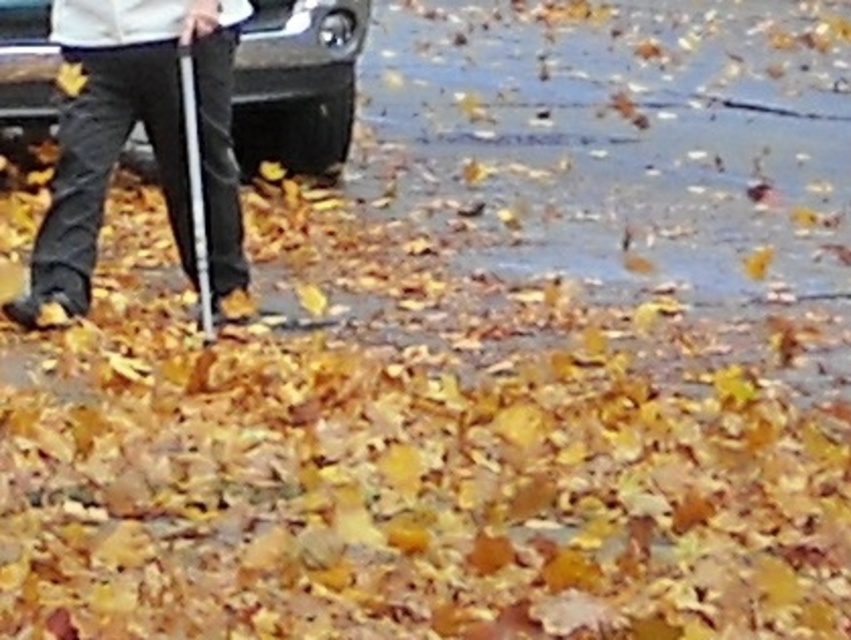
You are standing in an autumn scene with fallen leaves. You see a dark gray pants at left and a black matte car at center. Which object is smaller?

The dark gray pants at left is smaller than the black matte car at center.